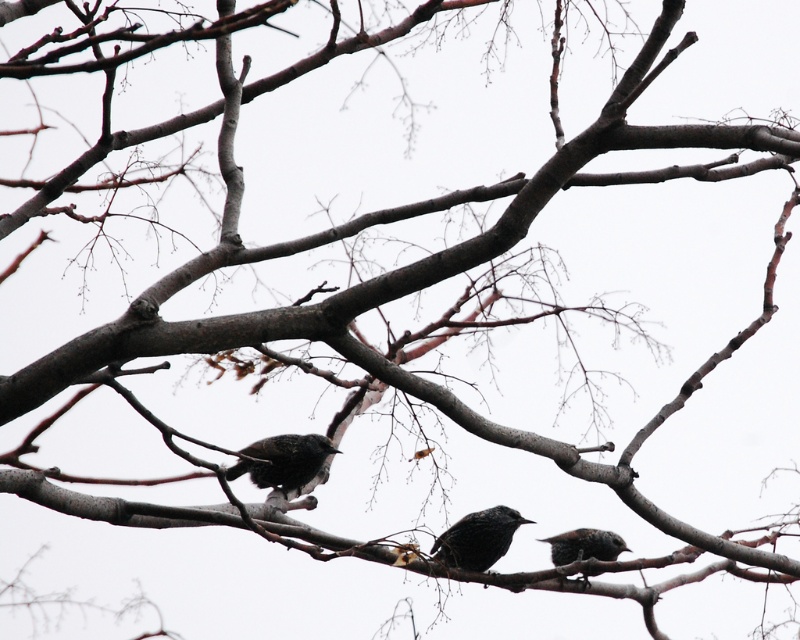
You are observing three birds on a tree branch. The birds are dark brown with speckled patterns. One of them is at point (284, 460). Can you identify which bird is at that exact coordinate?

The dark brown speckled bird at center is located at point (284, 460).

You are a birdwatcher observing the three birds in the image. You notice two specific birds labeled as dark gray feathers at center and dark gray speckled bird at lower right. Which of these two birds is larger in size?

The dark gray feathers at center is bigger than the dark gray speckled bird at lower right.